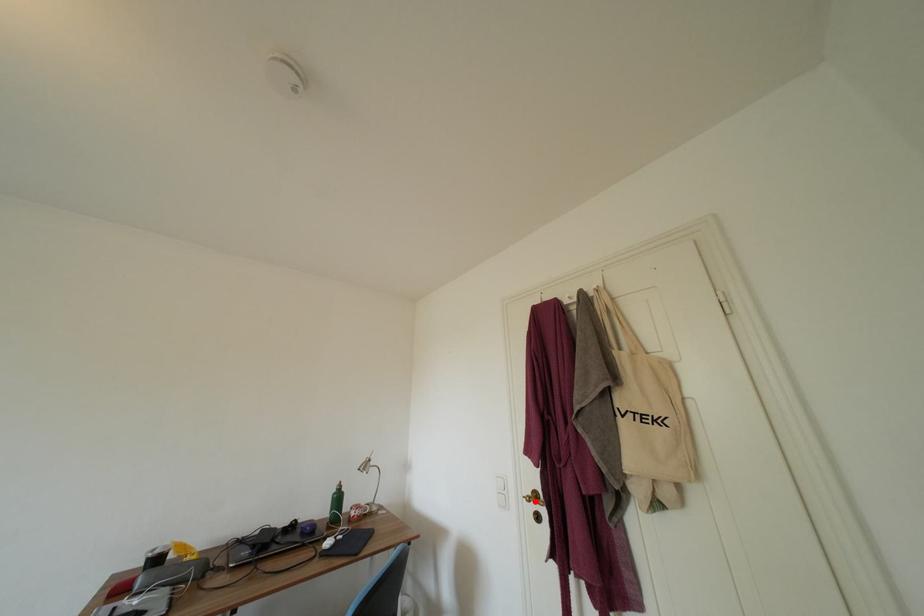
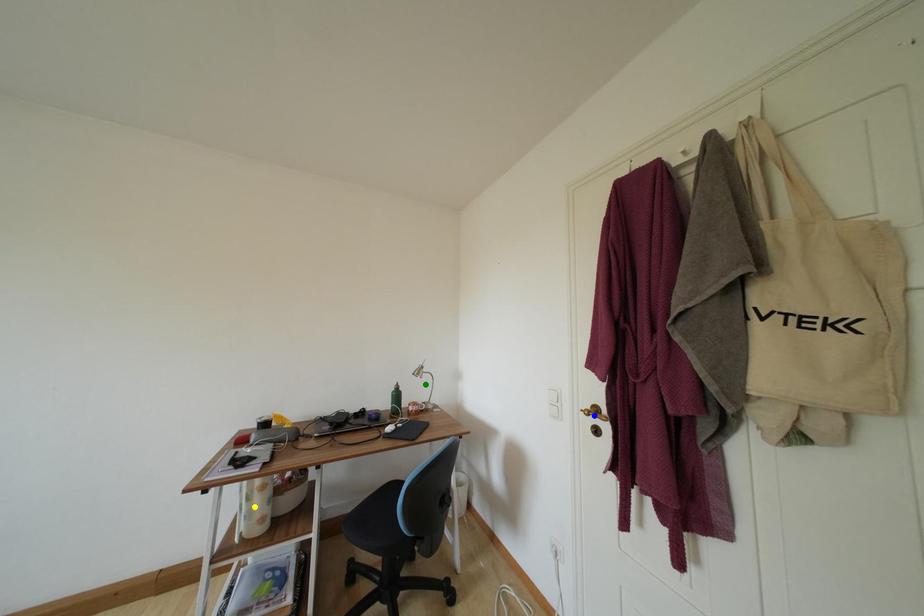
Question: I am providing you with two images of the same scene from different viewpoints. A red point is marked on the first image. You are given multiple points on the second image. Which mark in image 2 goes with the point in image 1?

Choices:
 (A) blue point
 (B) yellow point
 (C) green point

Answer: (A)